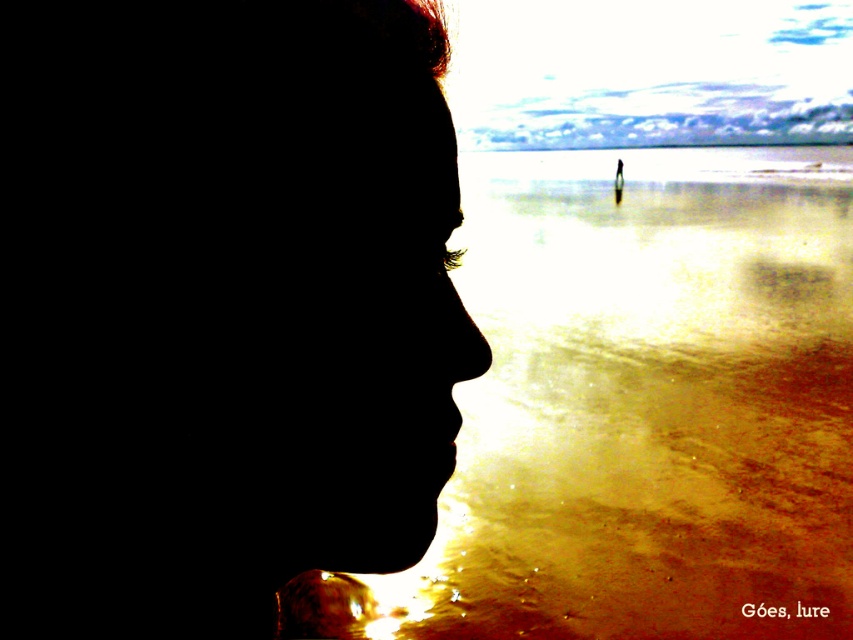
Who is more forward, (78, 161) or (817, 301)?

Point (78, 161) is in front.

Locate an element on the screen. This screenshot has width=853, height=640. black matte face at left is located at coordinates (219, 307).